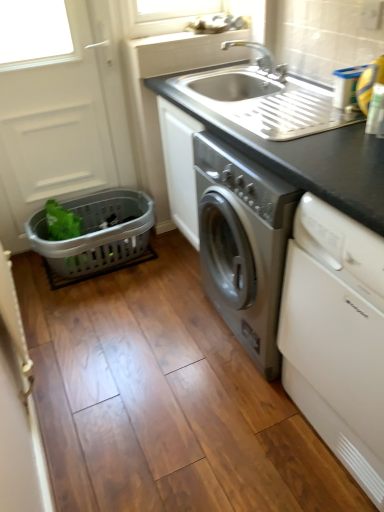
Question: From a real-world perspective, is white glossy dishwasher at lower right on green plastic basket at left?

Choices:
 (A) no
 (B) yes

Answer: (B)

Question: Is green plastic basket at left at the back of white glossy dishwasher at lower right?

Choices:
 (A) no
 (B) yes

Answer: (A)

Question: Could you tell me if white glossy dishwasher at lower right is turned towards green plastic basket at left?

Choices:
 (A) yes
 (B) no

Answer: (B)

Question: Does white glossy dishwasher at lower right have a lesser width compared to green plastic basket at left?

Choices:
 (A) no
 (B) yes

Answer: (A)

Question: Is white glossy dishwasher at lower right located outside green plastic basket at left?

Choices:
 (A) yes
 (B) no

Answer: (A)

Question: From a real-world perspective, relative to green plastic basket at left, is white glossy dishwasher at lower right vertically above or below?

Choices:
 (A) below
 (B) above

Answer: (B)

Question: Based on their sizes in the image, would you say white glossy dishwasher at lower right is bigger or smaller than green plastic basket at left?

Choices:
 (A) small
 (B) big

Answer: (B)

Question: Is point click(377, 311) positioned closer to the camera than point click(54, 203)?

Choices:
 (A) closer
 (B) farther

Answer: (A)

Question: Would you say white glossy dishwasher at lower right is to the left or to the right of green plastic basket at left in the picture?

Choices:
 (A) left
 (B) right

Answer: (B)

Question: Does point (107, 129) appear closer or farther from the camera than point (268, 58)?

Choices:
 (A) closer
 (B) farther

Answer: (B)

Question: In the image, is white matte screen door at left positioned in front of or behind silver metallic faucet at upper center?

Choices:
 (A) behind
 (B) front

Answer: (A)

Question: In terms of size, does white matte screen door at left appear bigger or smaller than silver metallic faucet at upper center?

Choices:
 (A) small
 (B) big

Answer: (B)

Question: From a real-world perspective, is white matte screen door at left above or below silver metallic faucet at upper center?

Choices:
 (A) above
 (B) below

Answer: (B)

Question: From a real-world perspective, relative to silver metallic faucet at upper center, is black matte sink at upper center vertically above or below?

Choices:
 (A) below
 (B) above

Answer: (A)

Question: In terms of width, does black matte sink at upper center look wider or thinner when compared to silver metallic faucet at upper center?

Choices:
 (A) thin
 (B) wide

Answer: (B)